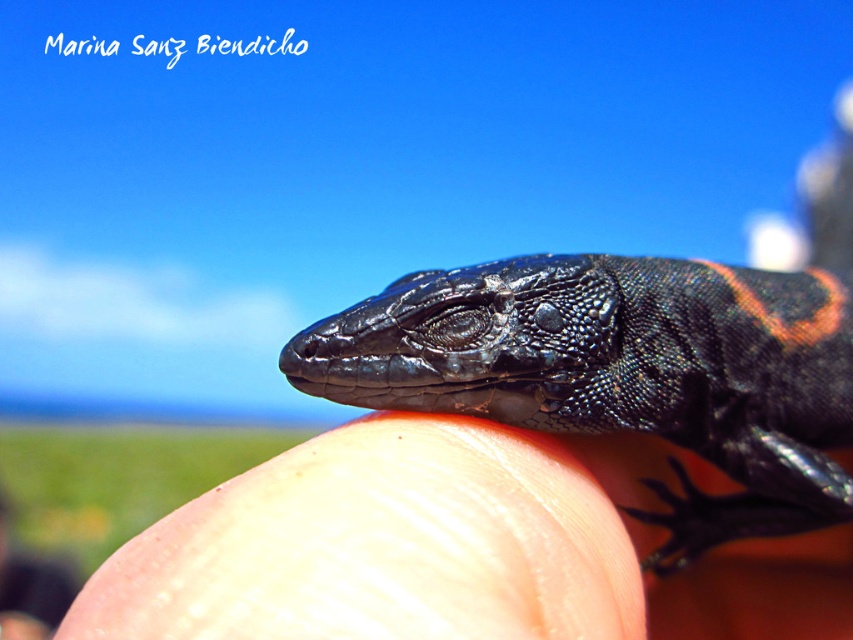
Question: Can you confirm if shiny black lizard at center is wider than smooth skin at center?

Choices:
 (A) no
 (B) yes

Answer: (B)

Question: Can you confirm if shiny black lizard at center is wider than smooth skin at center?

Choices:
 (A) yes
 (B) no

Answer: (A)

Question: Can you confirm if shiny black lizard at center is positioned to the left of smooth skin at center?

Choices:
 (A) yes
 (B) no

Answer: (B)

Question: Which object appears farthest from the camera in this image?

Choices:
 (A) shiny black lizard at center
 (B) smooth skin at center

Answer: (A)